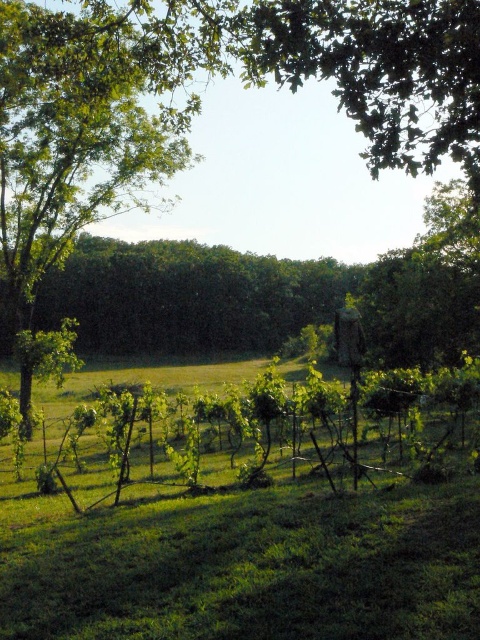
Between point (63, 625) and point (179, 83), which one is positioned in front?

Point (63, 625)

Does green leafy vines at center come in front of green leafy tree at left?

Yes, green leafy vines at center is closer to the viewer.

You are a GUI agent. You are given a task and a screenshot of the screen. Output one action in this format:
    pyautogui.click(x=<x>, y=<y>)
    Task: Click on the green leafy vines at center
    The image size is (480, 640).
    Given the screenshot: What is the action you would take?
    pyautogui.click(x=245, y=564)